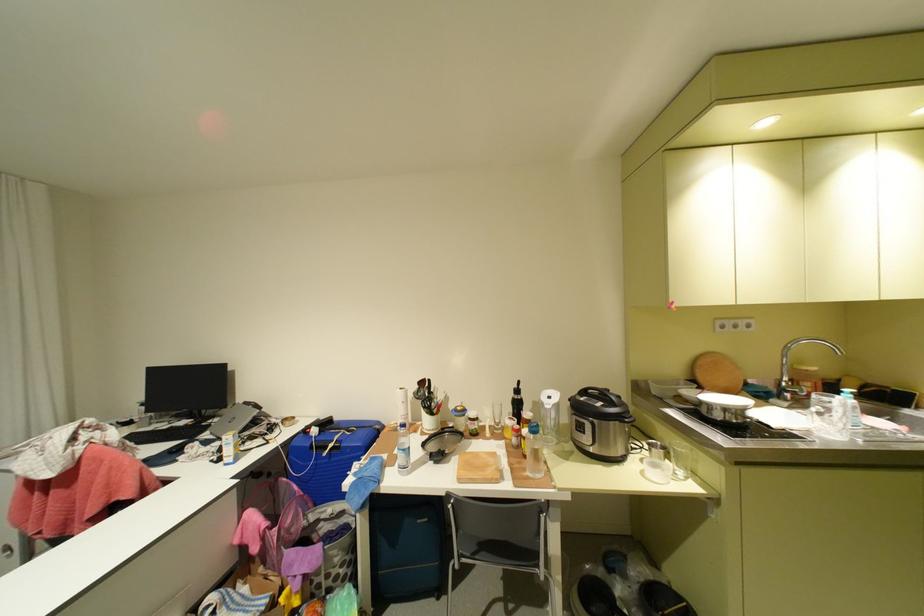
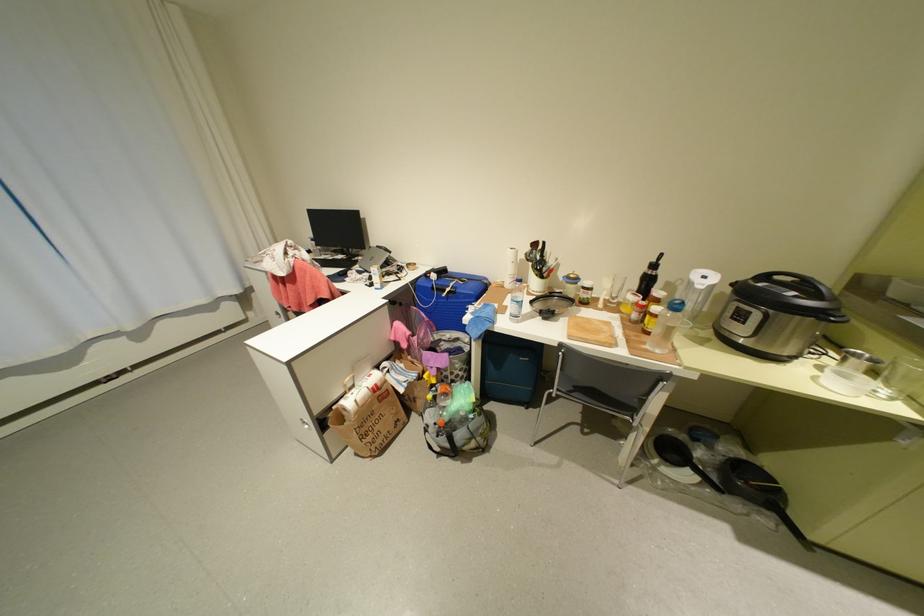
Find the pixel in the second image that matches pixel 325 431 in the first image.

(444, 276)